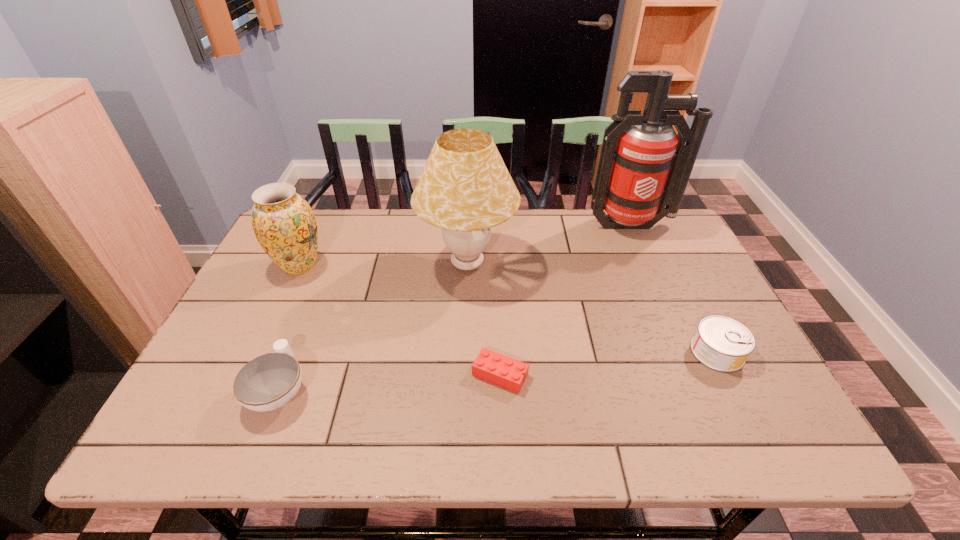
This screenshot has height=540, width=960. What are the coordinates of `free point between the chinaware and the fire extinguisher` in the screenshot? It's located at (455, 307).

This screenshot has width=960, height=540. In order to click on free area in between the can and the shortest object in this screenshot , I will do `click(609, 363)`.

I want to click on empty space between the can and the tallest object, so click(674, 288).

Where is `empty space between the chinaware and the Lego`? Image resolution: width=960 pixels, height=540 pixels. empty space between the chinaware and the Lego is located at coordinates pyautogui.click(x=390, y=382).

Where is `unoccupied position between the can and the fifth shortest object`? The width and height of the screenshot is (960, 540). unoccupied position between the can and the fifth shortest object is located at coordinates (592, 308).

Find the location of a particular element. The width and height of the screenshot is (960, 540). free area in between the vase and the can is located at coordinates (508, 309).

Locate an element on the screen. unoccupied area between the chinaware and the lampshade is located at coordinates (373, 327).

Locate an element on the screen. empty location between the can and the shortest object is located at coordinates (609, 363).

You are a GUI agent. You are given a task and a screenshot of the screen. Output one action in this format:
    pyautogui.click(x=<x>, y=<y>)
    Task: Click on the object that can be found as the closest to the fire extinguisher
    
    Given the screenshot: What is the action you would take?
    pyautogui.click(x=465, y=188)

Locate which object is the third closest to the vase. Please provide its 2D coordinates. Your answer should be formatted as a tuple, i.e. [(x, y)], where the tuple contains the x and y coordinates of a point satisfying the conditions above.

[(498, 369)]